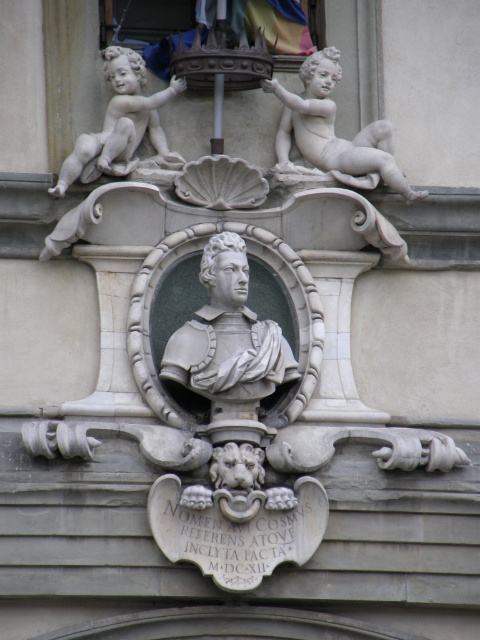
Does white marble cherub at upper right have a lesser width compared to white marble cherub at upper left?

No, white marble cherub at upper right is not thinner than white marble cherub at upper left.

Does point (331, 109) come in front of point (157, 138)?

No, it is not.

Who is more distant from viewer, (365,184) or (151,108)?

Positioned behind is point (151,108).

What are the coordinates of `white marble cherub at upper right` in the screenshot? It's located at (x=334, y=131).

Is point (188, 368) farther from viewer compared to point (367, 131)?

No, it is in front of (367, 131).

Who is more distant from viewer, (208, 282) or (330, 99)?

The point (330, 99) is behind.

Which is in front, point (219, 294) or point (372, 154)?

Point (219, 294) is more forward.

Locate an element on the screen. gray stone bust at center is located at coordinates (228, 337).

Can you confirm if gray stone bust at center is taller than white marble cherub at upper left?

Indeed, gray stone bust at center has a greater height compared to white marble cherub at upper left.

Which is in front, point (239, 358) or point (170, 84)?

Point (239, 358)

Identify the location of gray stone bust at center. The height and width of the screenshot is (640, 480). (228, 337).